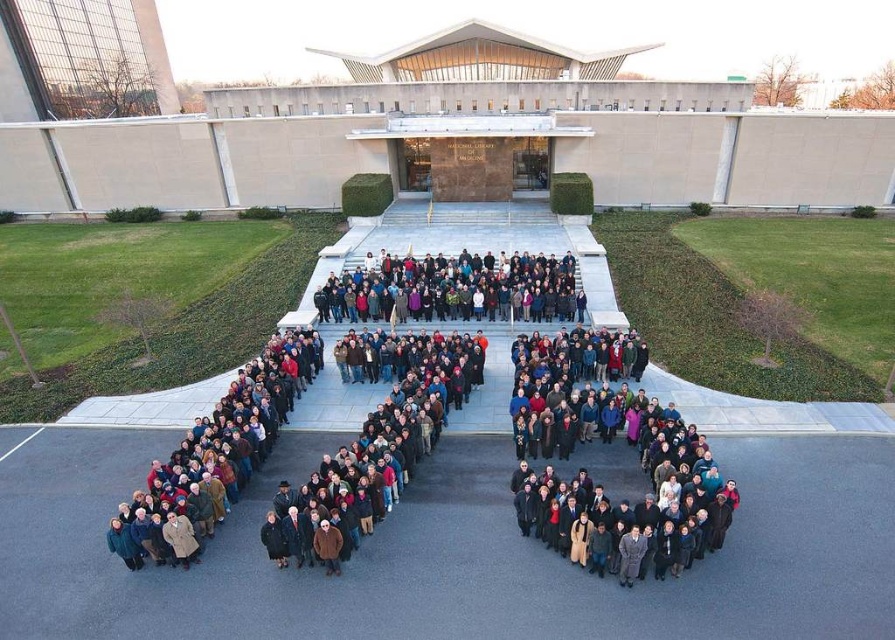
Based on the photo, which is more to the left, dark brown coat at center or dark gray fabric crowd at center?

dark brown coat at center is more to the left.

Who is positioned more to the right, dark brown coat at center or dark gray fabric crowd at center?

From the viewer's perspective, dark gray fabric crowd at center appears more on the right side.

Is point (553, 381) positioned after point (355, 298)?

That is False.

The image size is (895, 640). I want to click on dark brown coat at center, so click(586, 426).